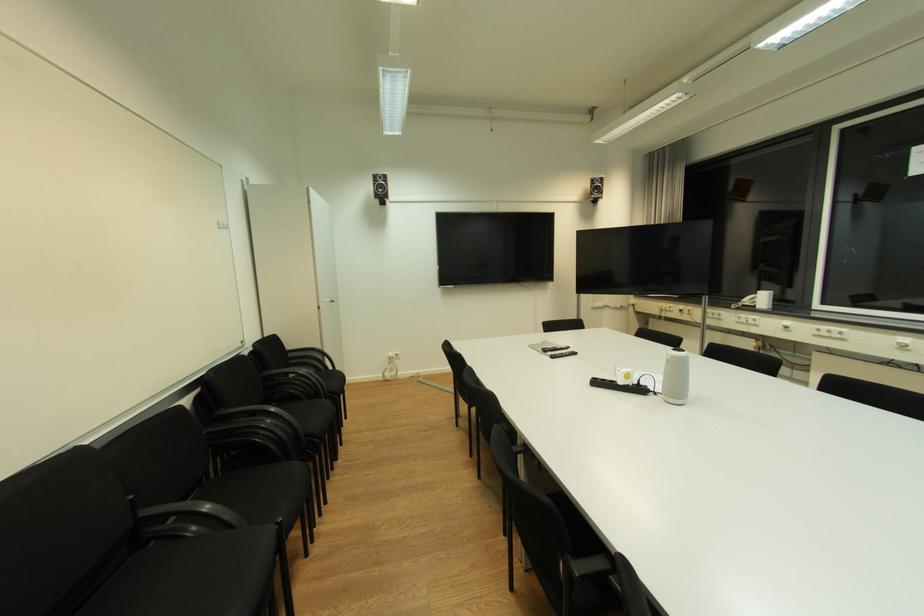
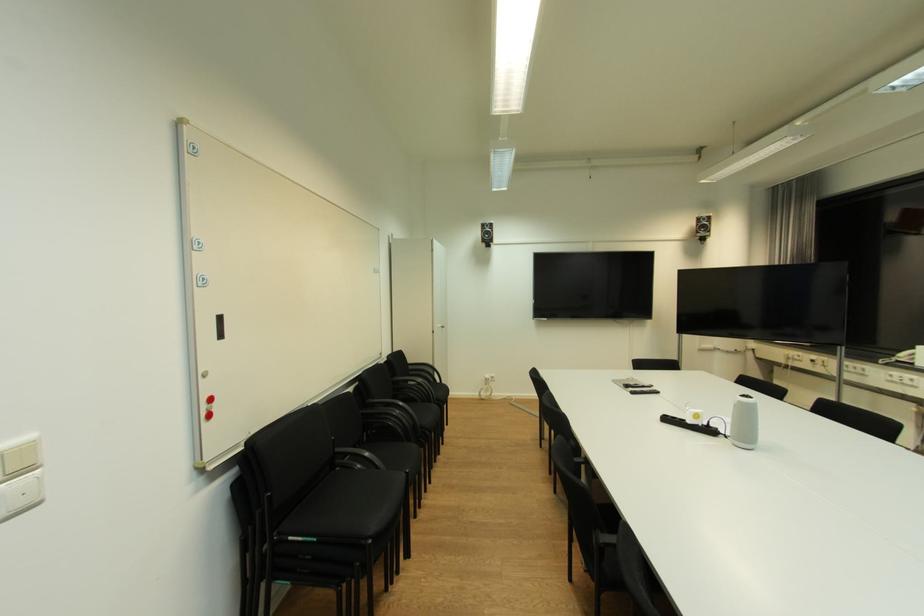
Locate, in the second image, the point that corresponds to point 602,192 in the first image.

(708, 231)